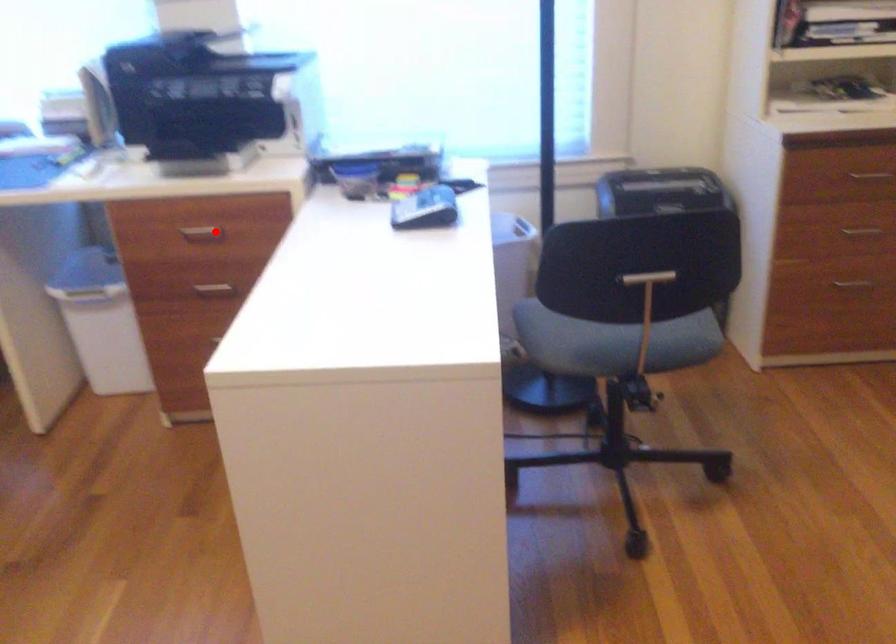
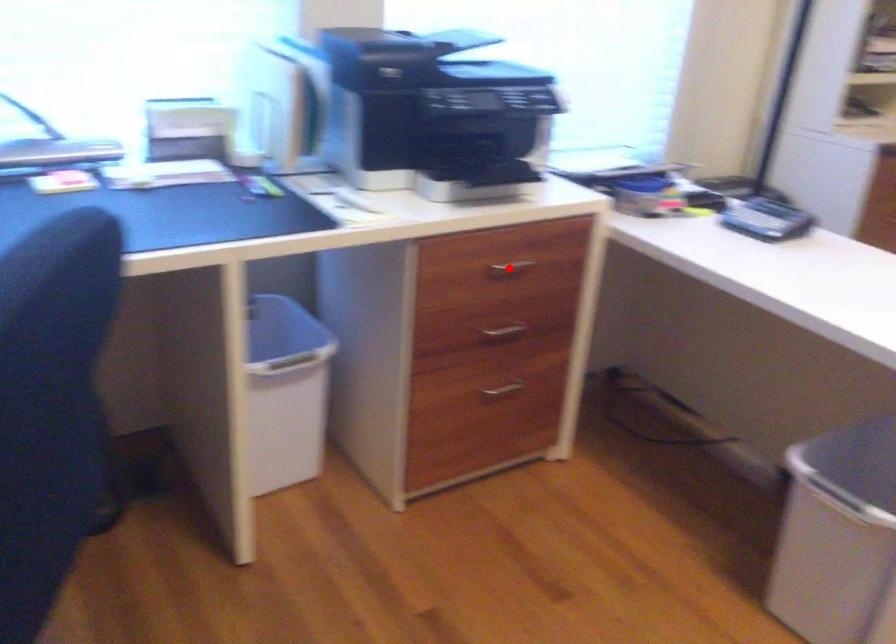
I am providing you with two images of the same scene from different viewpoints. A red point is marked on the first image and another point is marked on the second image. Is the marked point in image1 the same physical position as the marked point in image2?

Yes